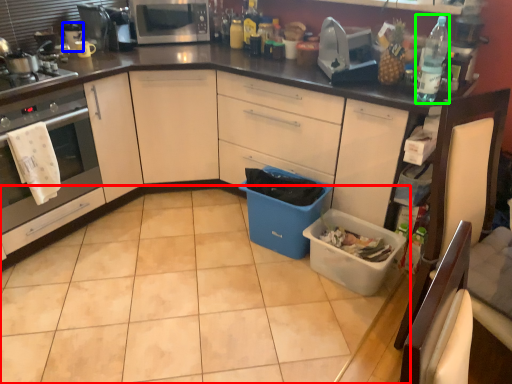
Question: Which is nearer to the tile (highlighted by a red box)? appliance (highlighted by a blue box) or bottle (highlighted by a green box).

Choices:
 (A) appliance
 (B) bottle

Answer: (B)